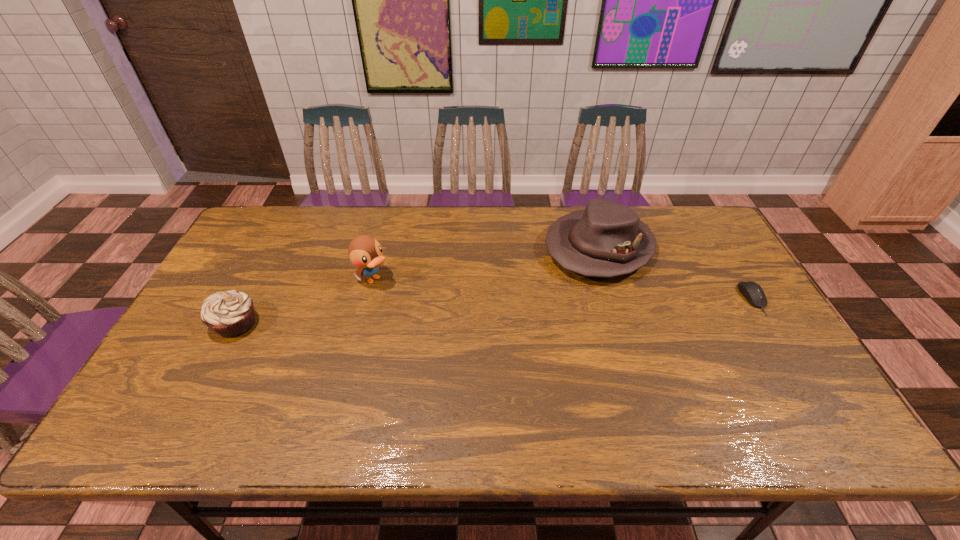
Where is `vacant space at the far left corner of the desktop`? vacant space at the far left corner of the desktop is located at coordinates (294, 214).

I want to click on vacant region at the far right corner, so [x=697, y=211].

Find the location of a particular element. vacant space in between the computer mouse and the leftmost object is located at coordinates (494, 311).

The width and height of the screenshot is (960, 540). In order to click on unoccupied area between the third tallest object and the hat in this screenshot , I will do `click(418, 286)`.

You are a GUI agent. You are given a task and a screenshot of the screen. Output one action in this format:
    pyautogui.click(x=<x>, y=<y>)
    Task: Click on the vacant region between the duck and the rightmost object
    Image resolution: width=960 pixels, height=540 pixels.
    Given the screenshot: What is the action you would take?
    pyautogui.click(x=564, y=289)

Locate an element on the screen. The image size is (960, 540). free spot between the third tallest object and the shortest object is located at coordinates (494, 311).

The width and height of the screenshot is (960, 540). I want to click on vacant area that lies between the second shortest object and the hat, so click(x=418, y=286).

You are a GUI agent. You are given a task and a screenshot of the screen. Output one action in this format:
    pyautogui.click(x=<x>, y=<y>)
    Task: Click on the vacant area between the second object from right to left and the leftmost object
    The height and width of the screenshot is (540, 960).
    Given the screenshot: What is the action you would take?
    pyautogui.click(x=418, y=286)

This screenshot has height=540, width=960. In order to click on free space between the hat and the leftmost object in this screenshot , I will do `click(418, 286)`.

You are a GUI agent. You are given a task and a screenshot of the screen. Output one action in this format:
    pyautogui.click(x=<x>, y=<y>)
    Task: Click on the vacant space that is in between the muffin and the duck
    
    Given the screenshot: What is the action you would take?
    pyautogui.click(x=304, y=301)